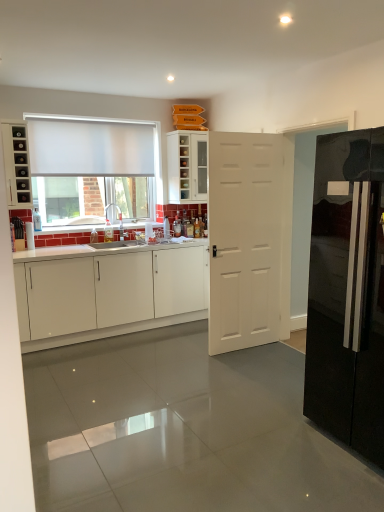
Question: Is frosted glass window at upper left in front of or behind white glossy cabinet at upper center, which ranks as the 1th cabinetry in top-to-bottom order, in the image?

Choices:
 (A) front
 (B) behind

Answer: (A)

Question: Considering the positions of frosted glass window at upper left and white glossy cabinet at upper center, which ranks as the 1th cabinetry in top-to-bottom order, in the image, is frosted glass window at upper left wider or thinner than white glossy cabinet at upper center, which ranks as the 1th cabinetry in top-to-bottom order,?

Choices:
 (A) wide
 (B) thin

Answer: (B)

Question: Which of these objects is positioned closest to the white glossy cabinets at left, the third cabinetry from the top?

Choices:
 (A) matte black cabinet at left, which ranks as the second cabinetry in bottom-to-top order
 (B) glossy black refrigerator at right
 (C) white glossy cabinet at upper center, which is counted as the third cabinetry, starting from the bottom
 (D) white matte door at center
 (E) white matte curtain at upper left

Answer: (D)

Question: Estimate the real-world distances between objects in this image. Which object is closer to the matte black cabinet at left, the second cabinetry from the top?

Choices:
 (A) white matte door at center
 (B) white glossy cabinet at upper center, which is counted as the third cabinetry, starting from the bottom
 (C) glossy black refrigerator at right
 (D) frosted glass window at upper left
 (E) white glossy cabinets at left, arranged as the first cabinetry when ordered from the bottom

Answer: (D)